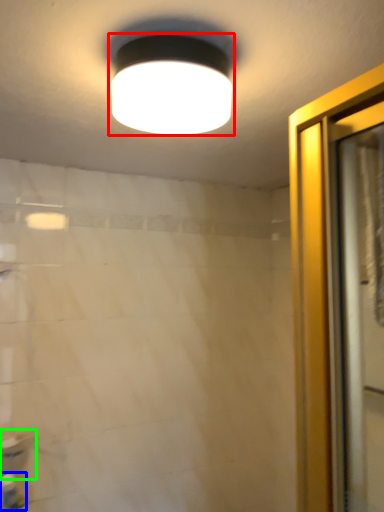
Question: Estimate the real-world distances between objects in this image. Which object is closer to lamp (highlighted by a red box), toiletry (highlighted by a blue box) or sink (highlighted by a green box)?

Choices:
 (A) toiletry
 (B) sink

Answer: (B)